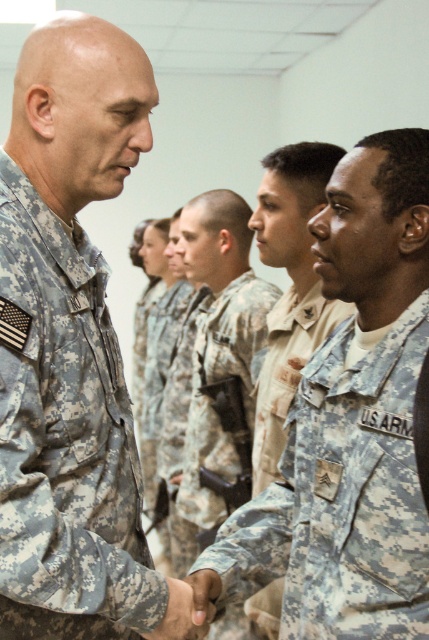
Question: Among these points, which one is nearest to the camera?

Choices:
 (A) (5, 545)
 (B) (404, 588)

Answer: (A)

Question: Does camouflage uniform at center appear under camouflage fabric uniform at left?

Choices:
 (A) no
 (B) yes

Answer: (A)

Question: Does camouflage uniform at center appear on the right side of camouflage fabric uniform at left?

Choices:
 (A) yes
 (B) no

Answer: (A)

Question: Which point is farther to the camera?

Choices:
 (A) camouflage uniform at center
 (B) camouflage fabric uniform at left

Answer: (A)

Question: Is camouflage uniform at center in front of camouflage fabric uniform at left?

Choices:
 (A) no
 (B) yes

Answer: (A)